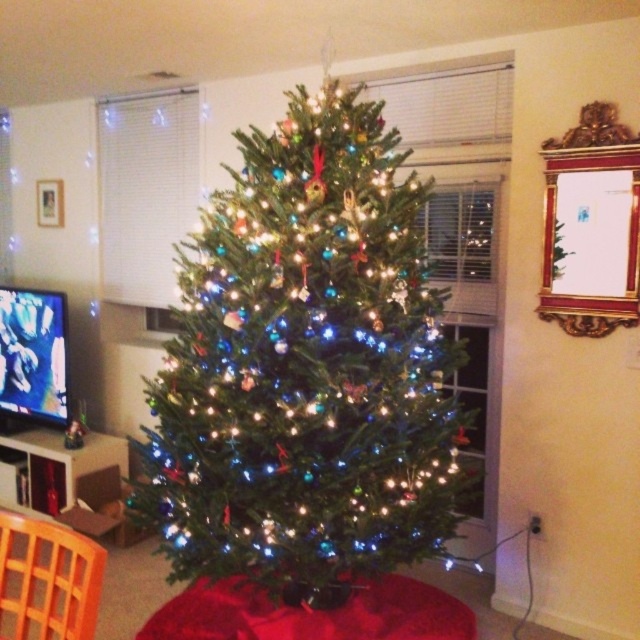
Who is taller, green matte christmas tree at center or orange plastic chair at lower left?

green matte christmas tree at center is taller.

Can you confirm if green matte christmas tree at center is wider than orange plastic chair at lower left?

Yes, green matte christmas tree at center is wider than orange plastic chair at lower left.

Between point (262, 566) and point (49, 570), which one is positioned behind?

Positioned behind is point (262, 566).

I want to click on green matte christmas tree at center, so click(x=305, y=368).